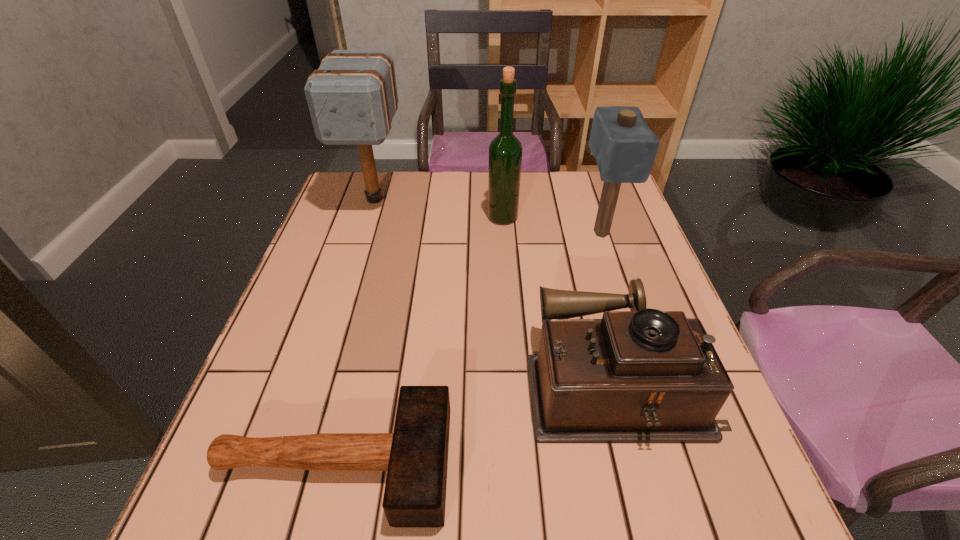
Image resolution: width=960 pixels, height=540 pixels. In order to click on free space at the near edge in this screenshot , I will do `click(666, 538)`.

Find the location of a particular element. The width and height of the screenshot is (960, 540). vacant space at the left edge is located at coordinates (297, 346).

Identify the location of vacant space at the right edge of the desktop. (627, 224).

Locate an element on the screen. The image size is (960, 540). free space at the near left corner of the desktop is located at coordinates (286, 525).

Where is `vacant area between the third tallest object and the liquor`? vacant area between the third tallest object and the liquor is located at coordinates (552, 225).

Find the location of a particular element. Image resolution: width=960 pixels, height=540 pixels. free area in between the nearest mallet and the liquor is located at coordinates (419, 340).

This screenshot has width=960, height=540. I want to click on the third closest object to the liquor, so click(x=641, y=376).

You are a GUI agent. You are given a task and a screenshot of the screen. Output one action in this format:
    pyautogui.click(x=<x>, y=<y>)
    Task: Click on the object that can be found as the second closest to the nearest mallet
    
    Given the screenshot: What is the action you would take?
    pyautogui.click(x=624, y=147)

At what (x,y) coordinates should I click in order to perform the action: click on mallet that is the closest to the phonograph_record. Please return your answer as a coordinate pair (x, y). The image size is (960, 540). Looking at the image, I should click on (415, 456).

Identify which mallet is the nearest to the second shortest mallet. Please provide its 2D coordinates. Your answer should be formatted as a tuple, i.e. [(x, y)], where the tuple contains the x and y coordinates of a point satisfying the conditions above.

[(352, 97)]